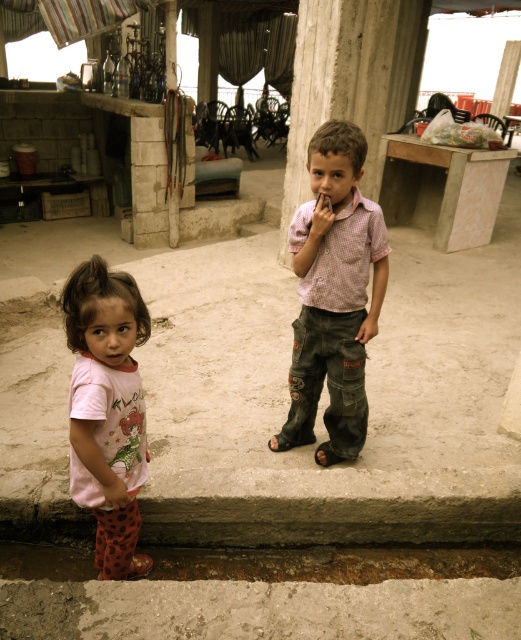
You are a photographer setting up a shot of the two children in the scene. You need to ensure that the checkered fabric shirt at center and the black leather sandal at lower center are both in focus. Given that your camera has a depth of field that can cover objects within 25 inches of each other, will both items be in focus?

The checkered fabric shirt at center is 26.76 inches from the black leather sandal at lower center. Since the distance exceeds the 25 inches depth of field, they cannot both be in focus simultaneously.

You are a fashion designer observing the two items in the image. Which item is taller between the checkered fabric shirt at center and the black leather sandal at lower center?

The checkered fabric shirt at center is taller than the black leather sandal at lower center according to the description.

You are a delivery robot with a package that needs to be placed on the gray concrete curb at lower center. The package is as wide as the black leather sandal at lower center. Will the package fit on the curb?

The gray concrete curb at lower center might be wider than black leather sandal at lower center, so the package, which is as wide as the sandal, should fit on the curb since the curb is likely wider.